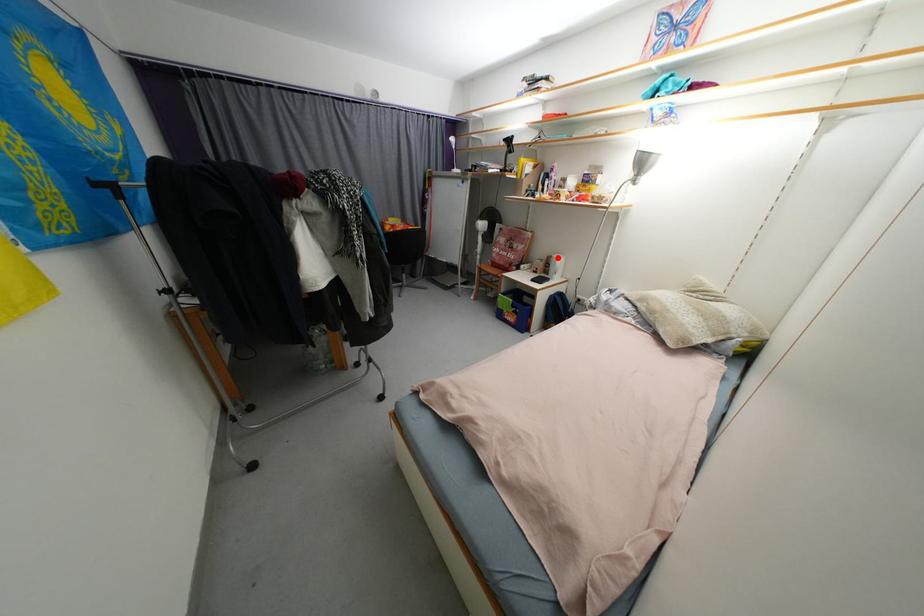
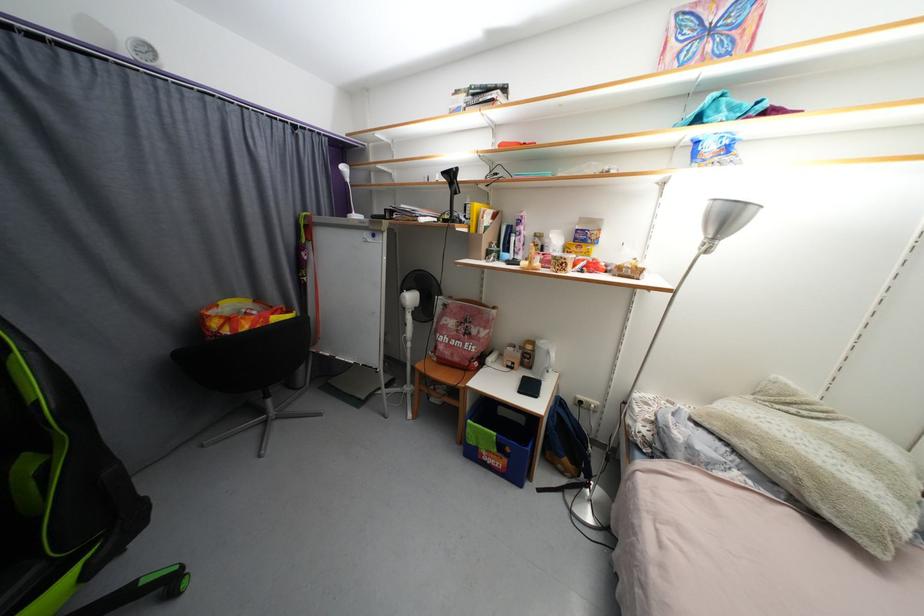
Where in the second image is the point corresponding to the highlighted location from the first image?

(538, 344)